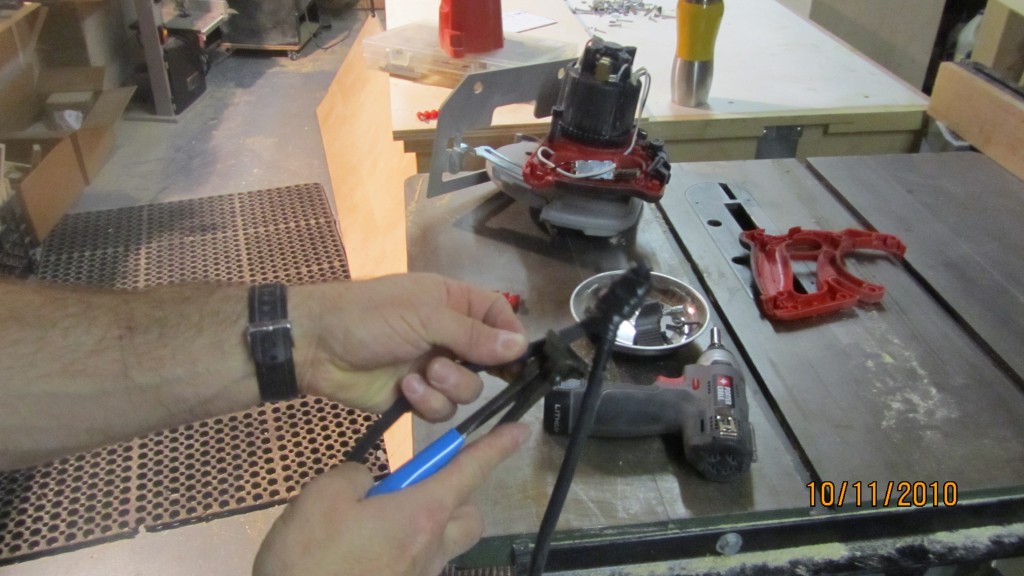
Locate an element on the screen. black mat is located at coordinates (190, 244).